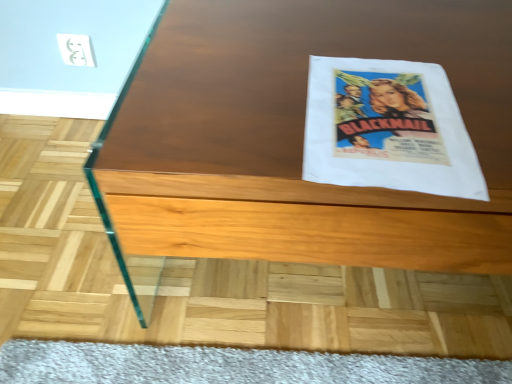
Question: Should I look upward or downward to see wooden table at center?

Choices:
 (A) up
 (B) down

Answer: (A)

Question: Is white paper flyer at upper right at the left side of wooden table at center?

Choices:
 (A) no
 (B) yes

Answer: (B)

Question: From a real-world perspective, is white paper flyer at upper right on top of wooden table at center?

Choices:
 (A) no
 (B) yes

Answer: (B)

Question: Is white paper flyer at upper right wider than wooden table at center?

Choices:
 (A) yes
 (B) no

Answer: (B)

Question: Is white paper flyer at upper right looking in the opposite direction of wooden table at center?

Choices:
 (A) yes
 (B) no

Answer: (A)

Question: Does white paper flyer at upper right have a smaller size compared to wooden table at center?

Choices:
 (A) yes
 (B) no

Answer: (A)

Question: Is white paper flyer at upper right beside wooden table at center?

Choices:
 (A) no
 (B) yes

Answer: (A)

Question: Is white paper flyer at upper right a part of wooden table at center?

Choices:
 (A) no
 (B) yes

Answer: (B)

Question: Does wooden table at center appear on the left side of white paper flyer at upper right?

Choices:
 (A) yes
 (B) no

Answer: (B)

Question: From a real-world perspective, is wooden table at center positioned over white paper flyer at upper right based on gravity?

Choices:
 (A) yes
 (B) no

Answer: (B)

Question: Is wooden table at center positioned beyond the bounds of white paper flyer at upper right?

Choices:
 (A) no
 (B) yes

Answer: (B)

Question: Are wooden table at center and white paper flyer at upper right beside each other?

Choices:
 (A) no
 (B) yes

Answer: (A)

Question: From a real-world perspective, is wooden table at center physically below white paper flyer at upper right?

Choices:
 (A) no
 (B) yes

Answer: (B)

Question: In the image, is white paper flyer at upper right positioned in front of or behind wooden table at center?

Choices:
 (A) front
 (B) behind

Answer: (B)